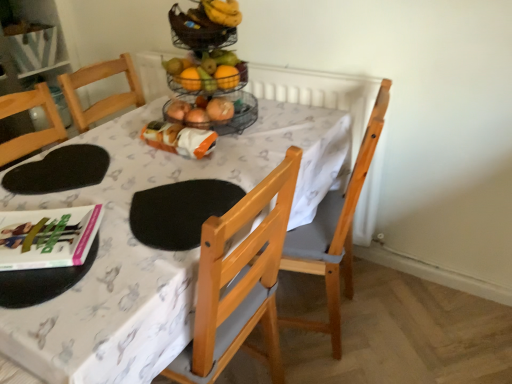
I want to click on light brown wooden chair at center, so click(334, 233).

What do you see at coordinates (179, 139) in the screenshot?
I see `orange plastic bag at center` at bounding box center [179, 139].

Describe the element at coordinates (47, 237) in the screenshot. This screenshot has height=384, width=512. I see `hardcover book at lower left` at that location.

The width and height of the screenshot is (512, 384). What do you see at coordinates (155, 250) in the screenshot? I see `white fabric table at center` at bounding box center [155, 250].

At what (x,y) coordinates should I click in order to perform the action: click on white fabric table at center. Please return your answer as a coordinate pair (x, y). Looking at the image, I should click on (155, 250).

The width and height of the screenshot is (512, 384). Describe the element at coordinates (208, 71) in the screenshot. I see `orange matte grapefruit at upper center` at that location.

Where is `black mesh basket at upper center`? Image resolution: width=512 pixels, height=384 pixels. black mesh basket at upper center is located at coordinates (198, 30).

Locate an element on the screen. This screenshot has width=512, height=384. light brown wooden chair at center is located at coordinates (334, 233).

Does light brown wooden chair at center come in front of black foam mat at upper left?

That is True.

How far apart are light brown wooden chair at center and black foam mat at upper left?

light brown wooden chair at center and black foam mat at upper left are 27.79 inches apart from each other.

From a real-world perspective, which is physically below, light brown wooden chair at center or black foam mat at upper left?

From a 3D spatial view, light brown wooden chair at center is below.

Which of these two, light brown wooden chair at center or black foam mat at upper left, stands taller?

light brown wooden chair at center is taller.

Is there a large distance between orange matte grapefruit at upper center and black mesh basket at upper center?

No, orange matte grapefruit at upper center is not far away from black mesh basket at upper center.

Is orange matte grapefruit at upper center not within black mesh basket at upper center?

Yes, orange matte grapefruit at upper center is not within black mesh basket at upper center.

Is orange matte grapefruit at upper center smaller than black mesh basket at upper center?

No.

From a real-world perspective, which is physically below, orange matte grapefruit at upper center or black mesh basket at upper center?

orange matte grapefruit at upper center, from a real-world perspective.

Which of these two, orange matte grapefruit at upper center or white fabric table at center, is wider?

Wider between the two is white fabric table at center.

Would you say orange matte grapefruit at upper center is inside or outside white fabric table at center?

The correct answer is: outside.

How distant is orange matte grapefruit at upper center from white fabric table at center?

orange matte grapefruit at upper center is 15.54 inches from white fabric table at center.

How many degrees apart are the facing directions of white fabric table at center and light brown wooden chair at center?

79.3 degrees separate the facing orientations of white fabric table at center and light brown wooden chair at center.

Can you confirm if white fabric table at center is positioned to the right of light brown wooden chair at center?

In fact, white fabric table at center is to the left of light brown wooden chair at center.

Is white fabric table at center with light brown wooden chair at center?

white fabric table at center and light brown wooden chair at center are clearly separated.

Could you tell me if white fabric table at center is turned towards light brown wooden chair at center?

No, white fabric table at center does not turn towards light brown wooden chair at center.

How different are the orientations of light brown wooden chair at center and hardcover book at lower left in degrees?

There is a 113-degree angle between the facing directions of light brown wooden chair at center and hardcover book at lower left.

Are light brown wooden chair at center and hardcover book at lower left beside each other?

No, light brown wooden chair at center is not beside hardcover book at lower left.

Locate an element on the screen. book located above the light brown wooden chair at center (from the image's perspective) is located at coordinates (47, 237).

Is light brown wooden chair at center bigger than hardcover book at lower left?

Correct, light brown wooden chair at center is larger in size than hardcover book at lower left.

You are a GUI agent. You are given a task and a screenshot of the screen. Output one action in this format:
    pyautogui.click(x=<x>, y=<y>)
    Task: Click on the book that is under the orange plastic bag at center (from a real-world perspective)
    This screenshot has width=512, height=384.
    Given the screenshot: What is the action you would take?
    pyautogui.click(x=47, y=237)

Is orange plastic bag at center with hardcover book at lower left?

No, orange plastic bag at center is not in contact with hardcover book at lower left.

Is black foam mat at upper left wider than hardcover book at lower left?

Yes.

What's the angular difference between black foam mat at upper left and hardcover book at lower left's facing directions?

The facing directions of black foam mat at upper left and hardcover book at lower left are 55.9 degrees apart.

From a real-world perspective, who is located higher, black foam mat at upper left or hardcover book at lower left?

hardcover book at lower left.

You are a GUI agent. You are given a task and a screenshot of the screen. Output one action in this format:
    pyautogui.click(x=<x>, y=<y>)
    Task: Click on the mat lying behind the light brown wooden chair at center
    The width and height of the screenshot is (512, 384).
    Given the screenshot: What is the action you would take?
    pyautogui.click(x=59, y=171)

Where is `grapefruit located below the black mesh basket at upper center (from the image's perspective)`? The image size is (512, 384). grapefruit located below the black mesh basket at upper center (from the image's perspective) is located at coordinates (208, 71).

Based on their spatial positions, is orange plastic bag at center or hardcover book at lower left closer to black mesh basket at upper center?

Based on the image, orange plastic bag at center appears to be nearer to black mesh basket at upper center.

From the image, which object appears to be farther from orange plastic bag at center, light brown wooden chair at center or black foam mat at upper left?

The object further to orange plastic bag at center is light brown wooden chair at center.

Looking at the image, which one is located closer to orange plastic bag at center, black mesh basket at upper center or white fabric table at center?

white fabric table at center is closer to orange plastic bag at center.

Estimate the real-world distances between objects in this image. Which object is further from orange plastic bag at center, light brown wooden chair at center or black mesh basket at upper center?

light brown wooden chair at center.

From the image, which object appears to be nearer to orange matte grapefruit at upper center, black mesh basket at upper center or light brown wooden chair at center?

Among the two, black mesh basket at upper center is located nearer to orange matte grapefruit at upper center.

Considering their positions, is black mesh basket at upper center positioned closer to black foam mat at upper left than light brown wooden chair at center?

black mesh basket at upper center lies closer to black foam mat at upper left than the other object.

Estimate the real-world distances between objects in this image. Which object is further from light brown wooden chair at center, black mesh basket at upper center or orange matte grapefruit at upper center?

The object further to light brown wooden chair at center is black mesh basket at upper center.

Looking at the image, which one is located closer to black foam mat at upper left, black mesh basket at upper center or orange plastic bag at center?

orange plastic bag at center is closer to black foam mat at upper left.

The width and height of the screenshot is (512, 384). I want to click on food that lies between black mesh basket at upper center and hardcover book at lower left from top to bottom, so click(x=179, y=139).

Identify the location of grapefruit between hardcover book at lower left and light brown wooden chair at center in the horizontal direction. The height and width of the screenshot is (384, 512). (208, 71).

Where is `book between black mesh basket at upper center and light brown wooden chair at center vertically`? book between black mesh basket at upper center and light brown wooden chair at center vertically is located at coordinates click(x=47, y=237).

You are a GUI agent. You are given a task and a screenshot of the screen. Output one action in this format:
    pyautogui.click(x=<x>, y=<y>)
    Task: Click on the food between black foam mat at upper left and orange matte grapefruit at upper center from left to right
    The height and width of the screenshot is (384, 512).
    Given the screenshot: What is the action you would take?
    pyautogui.click(x=179, y=139)